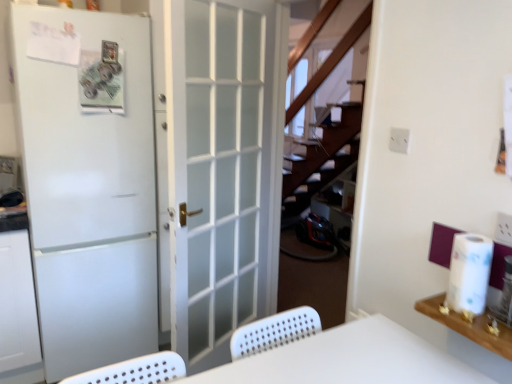
Question: From a real-world perspective, is white wood shelf at upper right physically above white paper at right?

Choices:
 (A) no
 (B) yes

Answer: (A)

Question: From the image's perspective, would you say white wood shelf at upper right is positioned over white paper at right?

Choices:
 (A) no
 (B) yes

Answer: (A)

Question: Can you see white wood shelf at upper right touching white paper at right?

Choices:
 (A) yes
 (B) no

Answer: (B)

Question: Does white wood shelf at upper right lie behind white paper at right?

Choices:
 (A) yes
 (B) no

Answer: (B)

Question: Is white wood shelf at upper right located outside white paper at right?

Choices:
 (A) no
 (B) yes

Answer: (B)

Question: From a real-world perspective, is white wood shelf at upper right located beneath white paper at right?

Choices:
 (A) no
 (B) yes

Answer: (B)

Question: From a real-world perspective, does white frosted glass door at center, the first door from the right, stand above white matte door at left, which ranks as the first door in left-to-right order?

Choices:
 (A) no
 (B) yes

Answer: (B)

Question: From a real-world perspective, is white frosted glass door at center, arranged as the 2th door when viewed from the left, located beneath white matte door at left, arranged as the 2th door when viewed from the right?

Choices:
 (A) no
 (B) yes

Answer: (A)

Question: Is white frosted glass door at center, the first door from the right, touching white matte door at left, arranged as the 2th door when viewed from the right?

Choices:
 (A) yes
 (B) no

Answer: (B)

Question: Is white matte door at left, which ranks as the first door in left-to-right order, surrounded by white frosted glass door at center, arranged as the 2th door when viewed from the left?

Choices:
 (A) no
 (B) yes

Answer: (A)

Question: Is white frosted glass door at center, the first door from the right, taller than white matte door at left, which ranks as the first door in left-to-right order?

Choices:
 (A) yes
 (B) no

Answer: (A)

Question: Does white frosted glass door at center, arranged as the 2th door when viewed from the left, have a lesser height compared to white matte door at left, which ranks as the first door in left-to-right order?

Choices:
 (A) no
 (B) yes

Answer: (A)

Question: Would you say white frosted glass door at center, the first door from the right, is part of white wood shelf at upper right's contents?

Choices:
 (A) no
 (B) yes

Answer: (A)